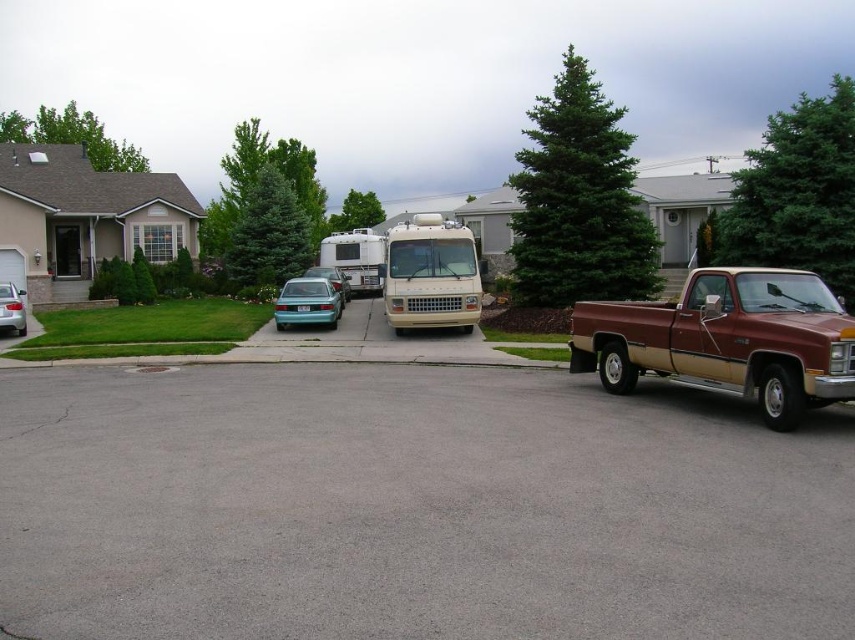
Question: Which of the following is the farthest from the observer?

Choices:
 (A) (301, 301)
 (B) (429, 291)
 (C) (22, 301)

Answer: (A)

Question: Considering the real-world distances, which object is closest to the teal glossy hatchback at center?

Choices:
 (A) gray asphalt driveway at lower right
 (B) teal matte car at center

Answer: (B)

Question: Is the position of gray asphalt driveway at lower right more distant than that of metallic silver rv at center?

Choices:
 (A) yes
 (B) no

Answer: (B)

Question: Which object is closer to the camera taking this photo?

Choices:
 (A) brown metallic truck at right
 (B) teal glossy sedan at lower left
 (C) teal glossy hatchback at center

Answer: (A)

Question: Can you confirm if metallic silver rv at center is bigger than teal glossy sedan at lower left?

Choices:
 (A) yes
 (B) no

Answer: (A)

Question: From the image, what is the correct spatial relationship of beige matte rv at center in relation to teal matte car at center?

Choices:
 (A) below
 (B) above

Answer: (B)